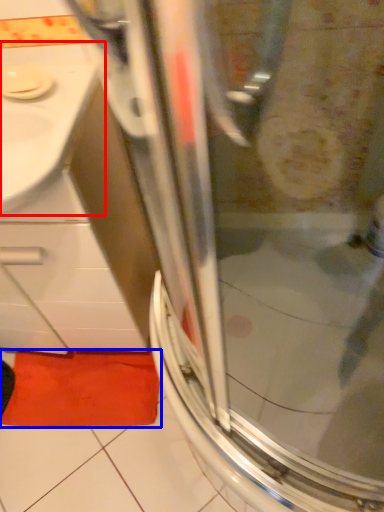
Question: Which object is closer to the camera taking this photo, sink (highlighted by a red box) or bath mat (highlighted by a blue box)?

Choices:
 (A) sink
 (B) bath mat

Answer: (A)